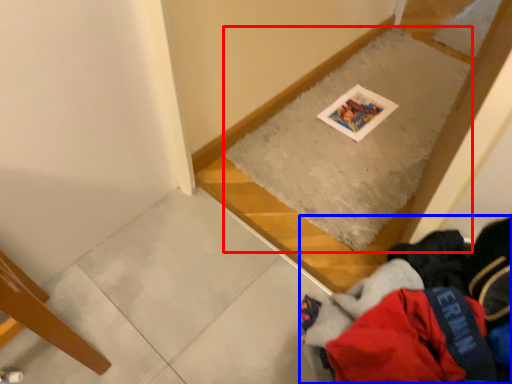
Question: Among these objects, which one is nearest to the camera, mat (highlighted by a red box) or clothing (highlighted by a blue box)?

Choices:
 (A) mat
 (B) clothing

Answer: (B)